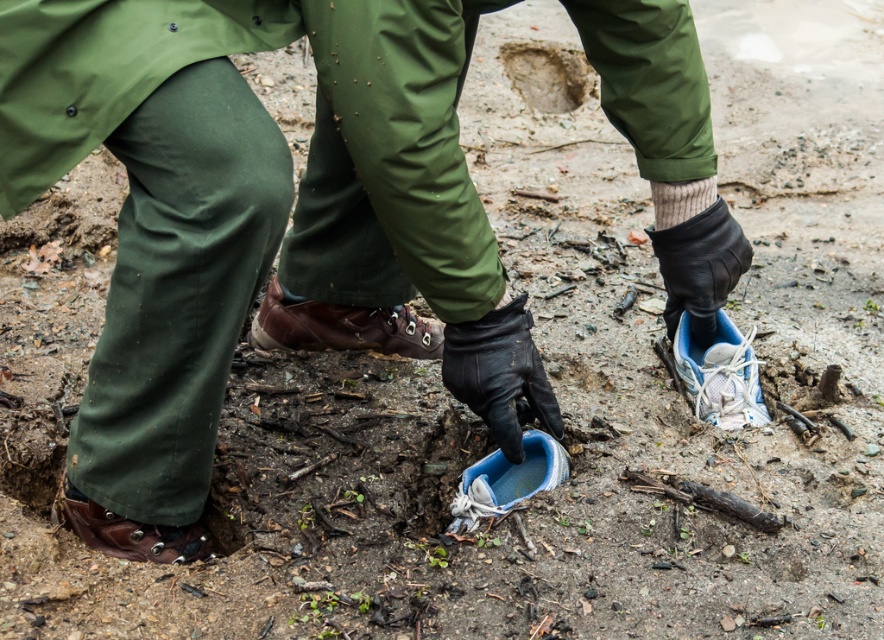
Question: Is brown dirt hole at center positioned before white knitted sock at lower right?

Choices:
 (A) no
 (B) yes

Answer: (A)

Question: Which of the following is the closest to the observer?

Choices:
 (A) tap(742, 244)
 (B) tap(408, 332)
 (C) tap(737, 364)

Answer: (A)

Question: Does black leather boot at lower right lie behind brown dirt hole at center?

Choices:
 (A) no
 (B) yes

Answer: (A)

Question: Which point appears farthest from the camera in this image?

Choices:
 (A) (265, 333)
 (B) (554, 93)

Answer: (B)

Question: Which is nearer to the white mesh shoe at lower right?

Choices:
 (A) black leather boot at lower right
 (B) brown dirt hole at center
 (C) white knitted sock at lower right
 (D) brown leather shoe at center

Answer: (A)

Question: Where is black leather boot at center located in relation to brown leather shoe at lower left in the image?

Choices:
 (A) left
 (B) right

Answer: (B)